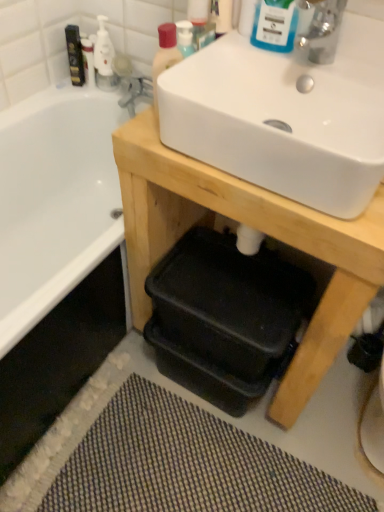
You are a GUI agent. You are given a task and a screenshot of the screen. Output one action in this format:
    pyautogui.click(x=<x>, y=<y>)
    Task: Click on the free location in front of matte black mouthwash at upper left, acting as the second mouthwash starting from the bottom
    
    Given the screenshot: What is the action you would take?
    pyautogui.click(x=62, y=101)